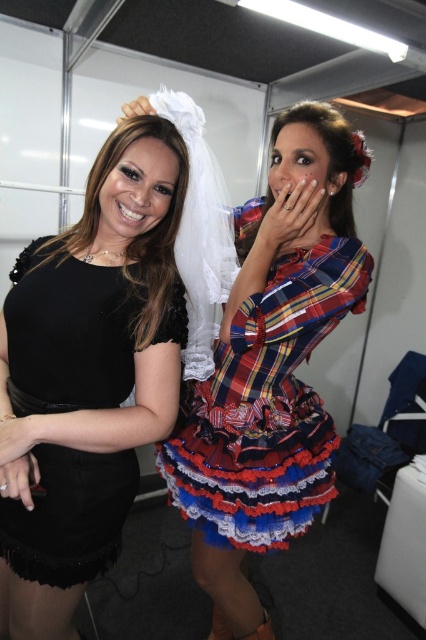
Does plaid fabric dress at center have a lesser height compared to black matte dress at left?

Incorrect, plaid fabric dress at center's height does not fall short of black matte dress at left's.

Who is higher up, plaid fabric dress at center or black matte dress at left?

black matte dress at left is above.

At what (x,y) coordinates should I click in order to perform the action: click on plaid fabric dress at center. Please return your answer as a coordinate pair (x, y). The height and width of the screenshot is (640, 426). Looking at the image, I should click on (271, 364).

Locate an element on the screen. Image resolution: width=426 pixels, height=640 pixels. plaid fabric dress at center is located at coordinates (271, 364).